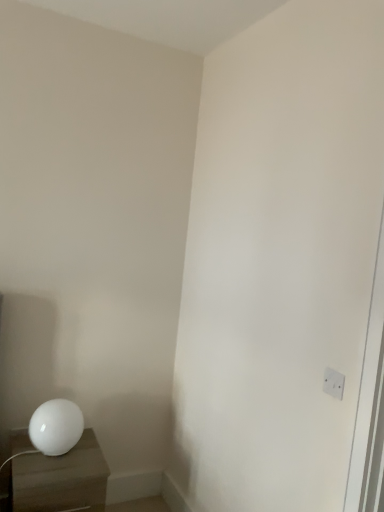
You are a GUI agent. You are given a task and a screenshot of the screen. Output one action in this format:
    pyautogui.click(x=<x>, y=<y>)
    Task: Click on the free space above white glossy nightstand at lower left (from a real-world perspective)
    
    Given the screenshot: What is the action you would take?
    click(57, 460)